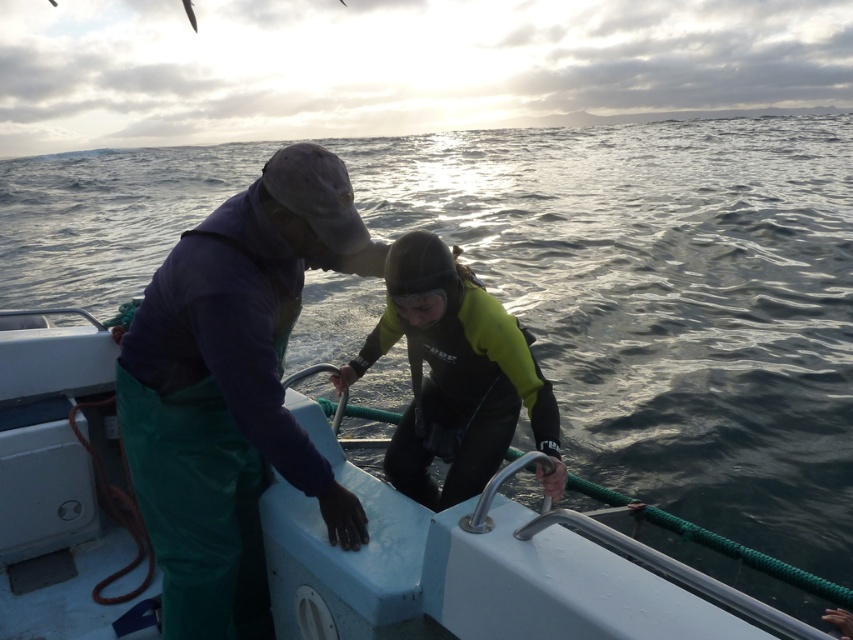
Looking at this image, you are on a boat deck and want to know which of the two points, point [671,596] or point [125,349], is closer to you. Can you determine this based on the scene?

Point [671,596] is closer to the camera than point [125,349], so it is closer to you.

You are standing on the deck of the boat and need to locate the neoprene wetsuit at center. According to the coordinates provided, where exactly should you look?

The neoprene wetsuit at center is located at coordinates point (454,376).

You are a photographer on the deck of the boat and want to take a photo of the neoprene wetsuit at center and the white plastic boat at center. If you position yourself so that the boat is between you and the wetsuit, will the boat block the view of the wetsuit?

The neoprene wetsuit at center is behind the white plastic boat at center, so positioning the boat between you and the wetsuit would block the view of the wetsuit.